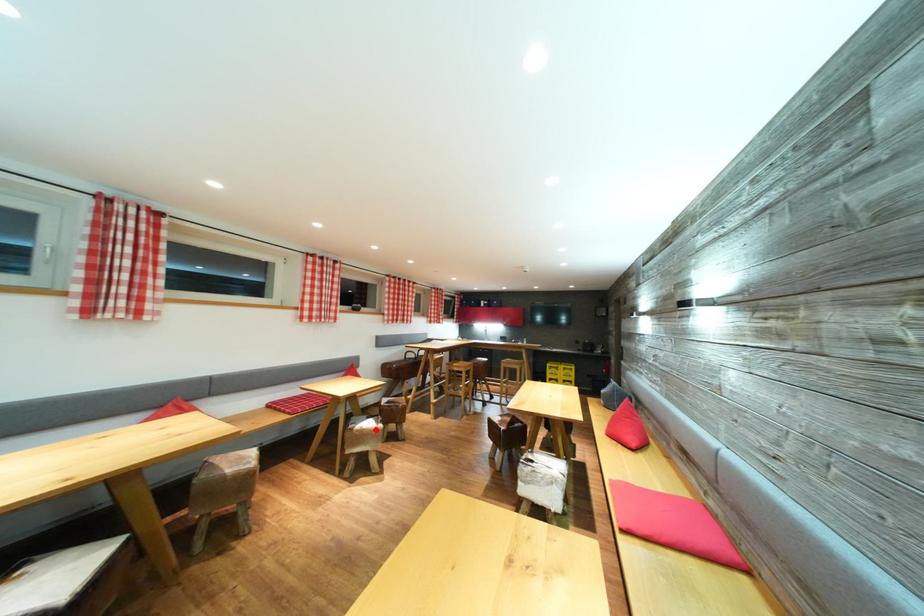
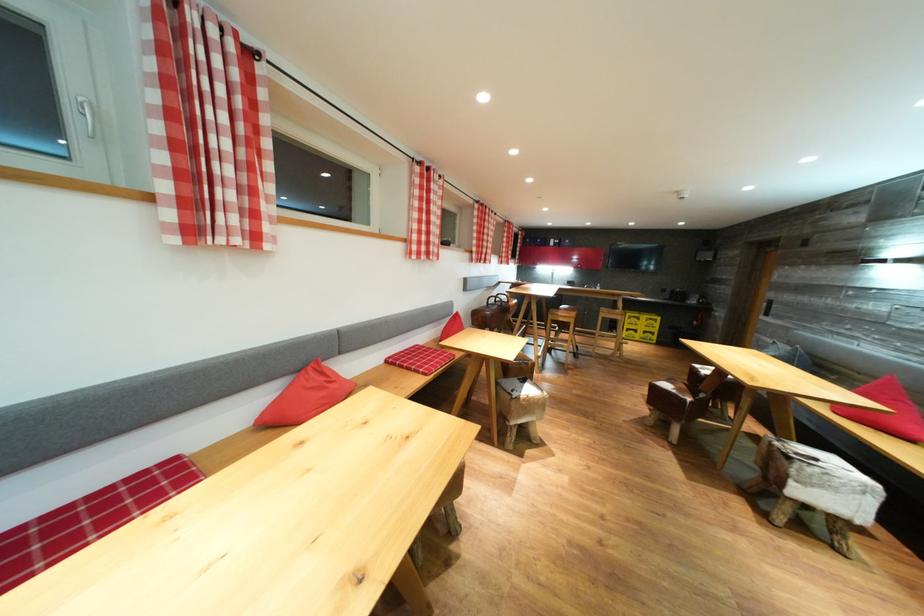
Where in the second image is the point corresponding to the highlighted location from the first image?

(536, 395)